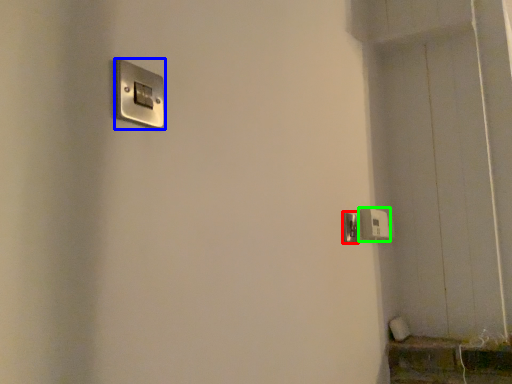
Question: Estimate the real-world distances between objects in this image. Which object is farther from door handle (highlighted by a red box), light switch (highlighted by a blue box) or light switch (highlighted by a green box)?

Choices:
 (A) light switch
 (B) light switch

Answer: (A)